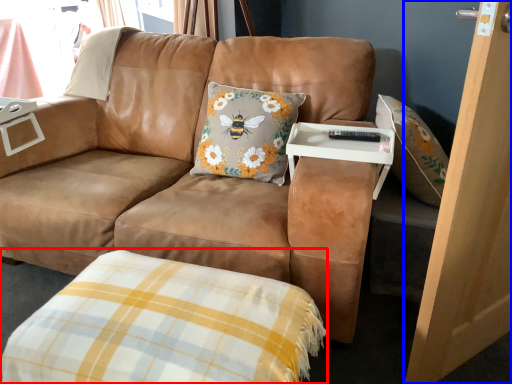
Question: Among these objects, which one is nearest to the camera, plaid (highlighted by a red box) or screen door (highlighted by a blue box)?

Choices:
 (A) plaid
 (B) screen door

Answer: (B)